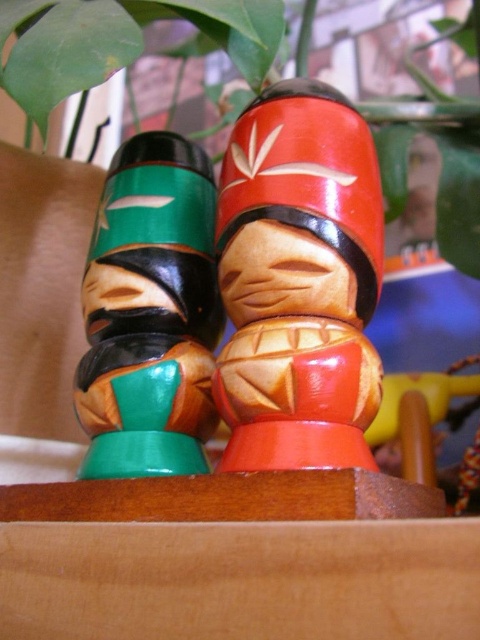
Which is more to the right, wooden box at center or green matte plant at upper center?

green matte plant at upper center is more to the right.

Can you confirm if wooden box at center is bigger than green matte plant at upper center?

Actually, wooden box at center might be smaller than green matte plant at upper center.

Is point (136, 545) closer to viewer compared to point (55, 49)?

Yes, point (136, 545) is closer to viewer.

This screenshot has width=480, height=640. Identify the location of wooden box at center. (237, 557).

Which is behind, point (377, 205) or point (193, 269)?

Positioned behind is point (193, 269).

Who is taller, shiny red wood figurine at center or green matte wooden totem at left?

Standing taller between the two is green matte wooden totem at left.

Locate an element on the screen. shiny red wood figurine at center is located at coordinates (299, 282).

Does wooden box at center appear under shiny red wood figurine at center?

Indeed, wooden box at center is positioned under shiny red wood figurine at center.

Between wooden box at center and shiny red wood figurine at center, which one appears on the left side from the viewer's perspective?

wooden box at center is more to the left.

Identify the location of wooden box at center. (237, 557).